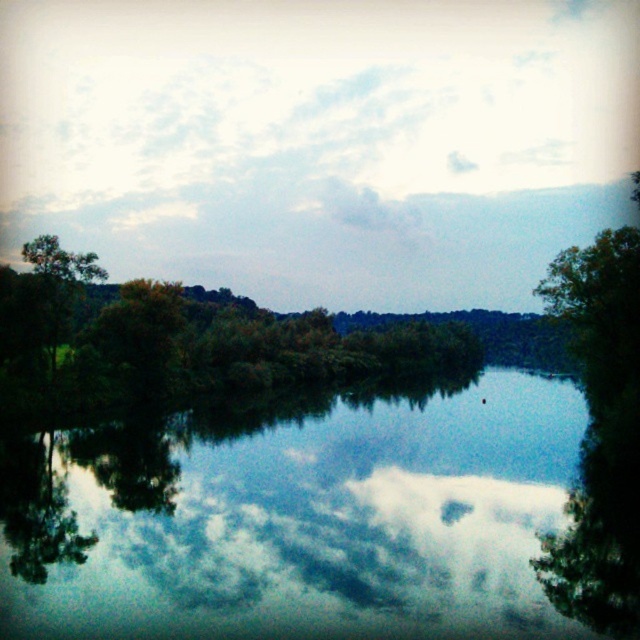
You are standing at the center of the image and want to locate the green leafy tree at right. In which direction should you look to find it?

The green leafy tree at right is located at the right side of the image, so you should look to your right to find it.

You are standing at the edge of the water and want to take a photo of both the transparent glass water at center and the green leafy tree at left. Which object should you frame first in your camera to ensure both are in the shot?

You should frame the green leafy tree at left first because the transparent glass water at center is positioned on the right side of it, so by starting with the tree, you can ensure the water is also captured to its right.